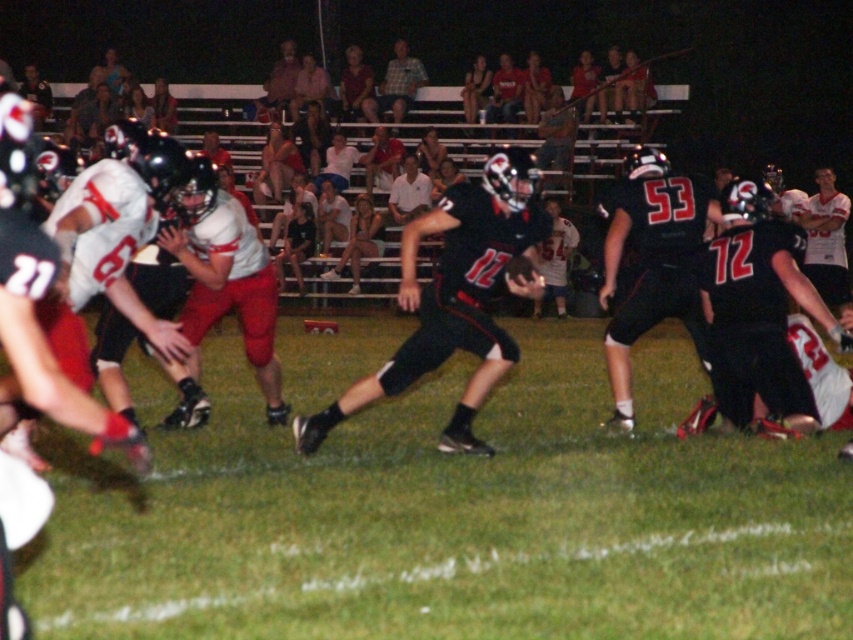
Question: Which object is closer to the camera taking this photo?

Choices:
 (A) black matte football player at center
 (B) black jersey at center
 (C) plaid shirt at upper center

Answer: (A)

Question: Is black matte jersey at center wider than white jersey at left?

Choices:
 (A) no
 (B) yes

Answer: (B)

Question: Which point is farther to the camera?

Choices:
 (A) (376, 100)
 (B) (819, 225)
 (C) (424, 305)

Answer: (A)

Question: Does black jersey at center lie behind white shirt at center?

Choices:
 (A) no
 (B) yes

Answer: (A)

Question: Is black matte jersey at center positioned in front of black matte jersey at right?

Choices:
 (A) no
 (B) yes

Answer: (B)

Question: Which of the following is the closest to the observer?

Choices:
 (A) white jersey at upper right
 (B) black matte jersey at center
 (C) white jersey at left

Answer: (C)